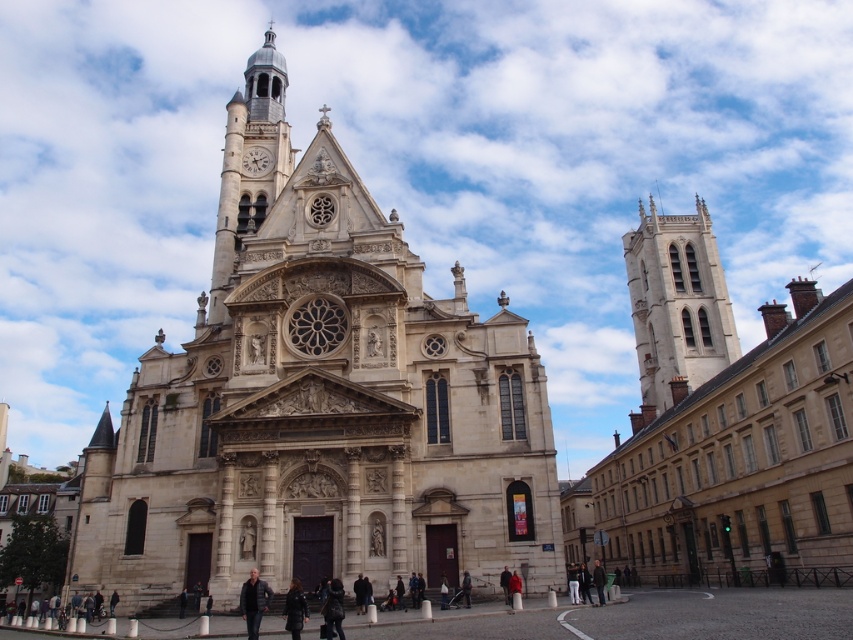
You are standing in front of the historic church and notice two jackets hanging on a rack near the entrance. The dark brown leather jacket at center and the red jacket at center. Which jacket is positioned higher?

The dark brown leather jacket at center is located above the red jacket at center, so it is positioned higher.

You are standing in front of the grand historic church and notice a dark brown leather jacket at center. Where exactly is the dark brown leather jacket located in relation to the church?

The dark brown leather jacket at center is located at the coordinates point (334, 611) relative to the church.

You are standing in front of the church and notice two leather jackets. One is the dark gray leather jacket at center and the other is the leather jacket at lower center. Which one is positioned higher relative to the other?

The dark gray leather jacket at center is positioned higher than the leather jacket at lower center because it is located above it.